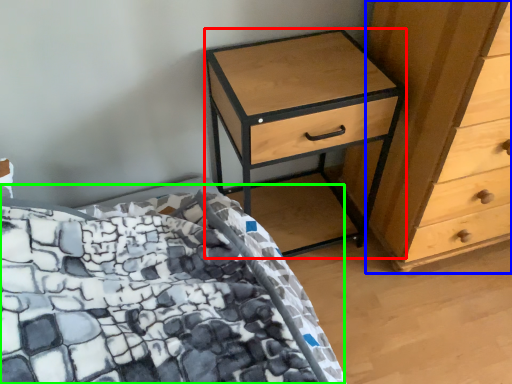
Question: Considering the real-world distances, which object is closest to nightstand (highlighted by a red box)? chest of drawers (highlighted by a blue box) or bed (highlighted by a green box).

Choices:
 (A) chest of drawers
 (B) bed

Answer: (A)